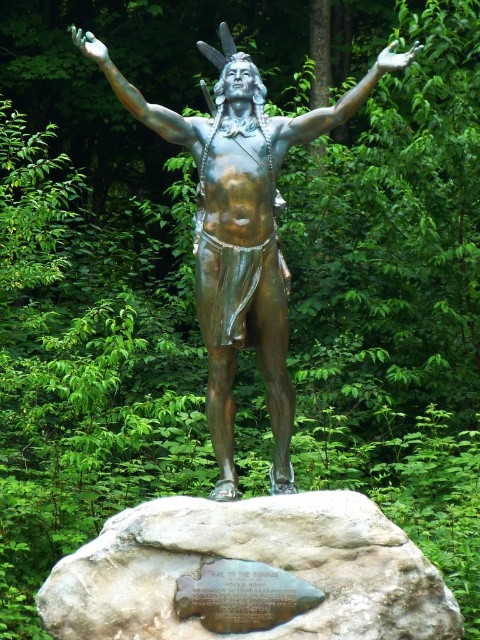
Who is higher up, bronze statue at center or gray stone plaque at center?

bronze statue at center is higher up.

Consider the image. Is bronze statue at center taller than gray stone plaque at center?

Yes, bronze statue at center is taller than gray stone plaque at center.

Does point (194, 138) come closer to viewer compared to point (133, 508)?

That is False.

Where is `bronze statue at center`? The height and width of the screenshot is (640, 480). bronze statue at center is located at coordinates 240,228.